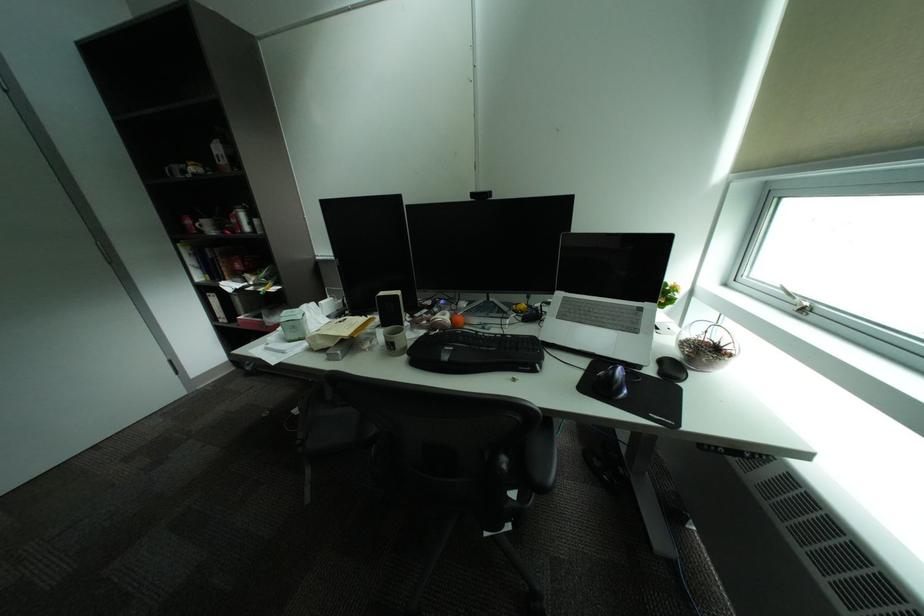
Find where to lift the glass terrarium. Please return your answer as a coordinate pair (x, y).

(706, 345)